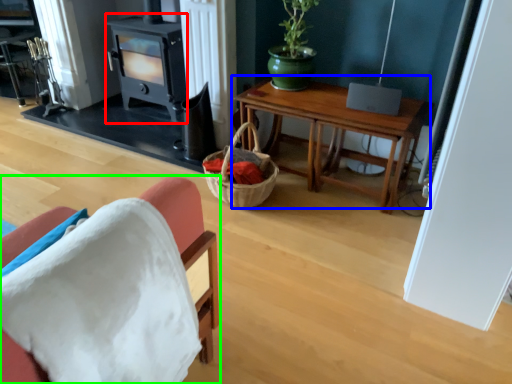
Question: Which object is positioned farthest from fireplace (highlighted by a red box)? Select from table (highlighted by a blue box) and chair (highlighted by a green box).

Choices:
 (A) table
 (B) chair

Answer: (B)